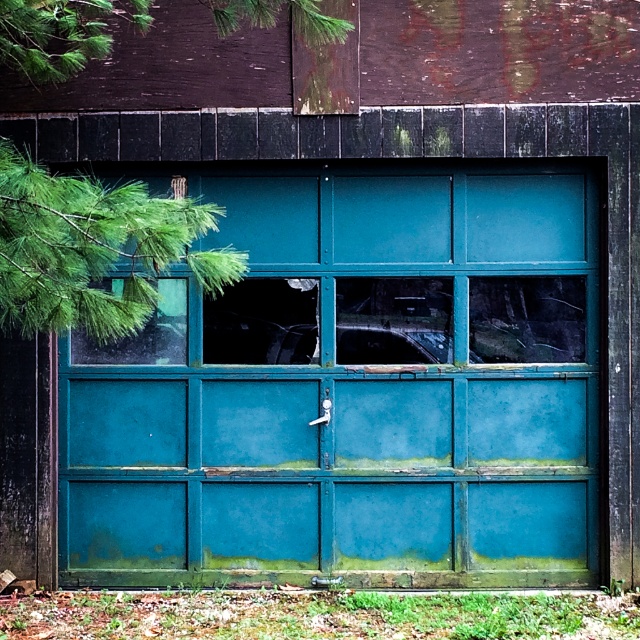
You are standing in front of the teal painted wood garage door at center and the teal matte window at center. Which object is more to the left?

The teal painted wood garage door at center is more to the left than the teal matte window at center.

Consider the image. You are a painter assessing the scene. You need to decide which object requires more attention based on their sizes. Which object should you focus on first, the teal painted wood garage door at center or the green leafy branch at upper left?

The teal painted wood garage door at center has a larger size compared to the green leafy branch at upper left, so you should focus on the teal painted wood garage door at center first because it requires more attention due to its larger size.